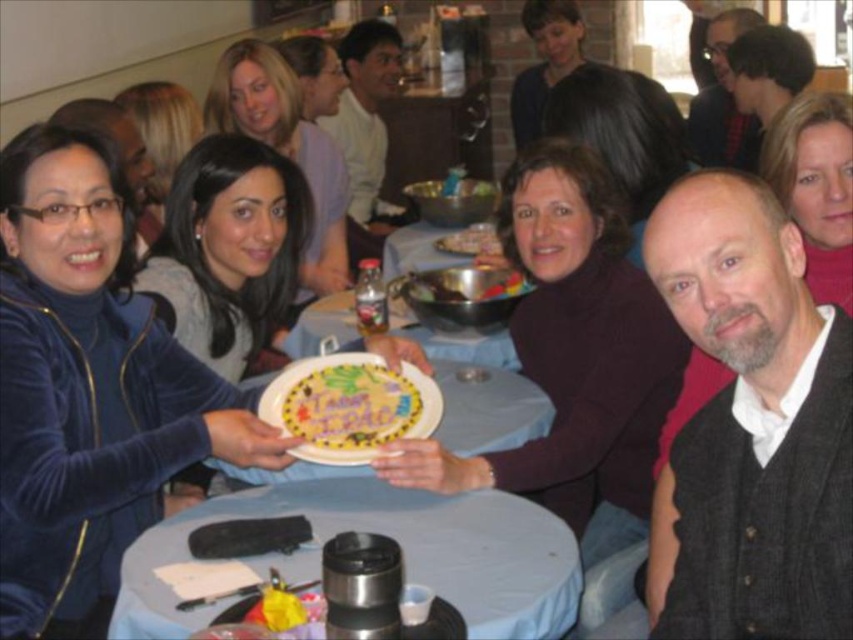
You are at a party and see the smooth plastic table at center and the smooth chocolate cake at center. Which object is positioned to the left?

The smooth plastic table at center is positioned to the left of the smooth chocolate cake at center.

Where is the smooth plastic table at center located in the image?

The smooth plastic table at center is located at point (392, 536) in the image.

Consider the image. You are planning to place a decorative paper plate at center on top of the smooth plastic table at center. Will the plate fit entirely on the table?

The smooth plastic table at center is larger in size than decorative paper plate at center, so the plate will fit entirely on the table.